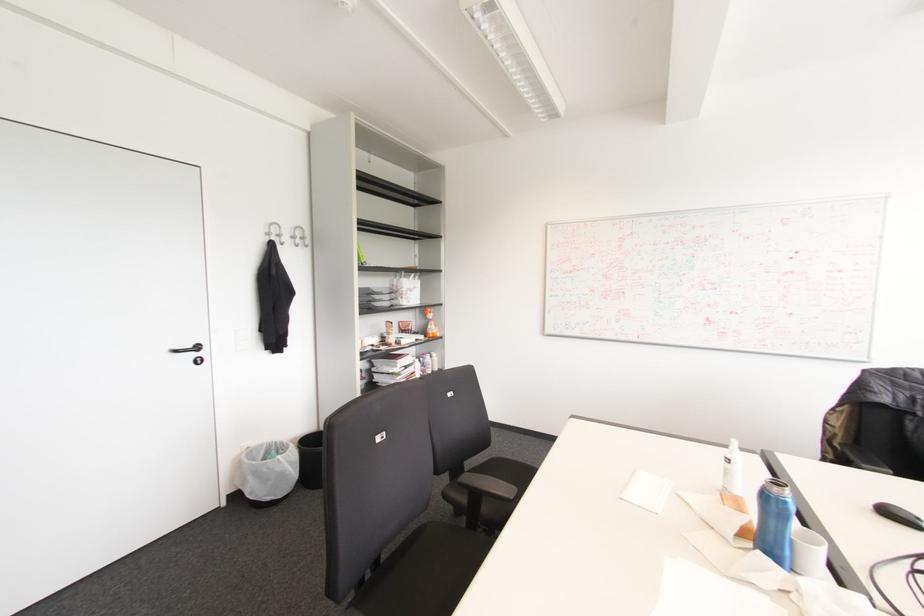
Where is `chair sitting surface`? The height and width of the screenshot is (616, 924). chair sitting surface is located at coordinates point(433,570).